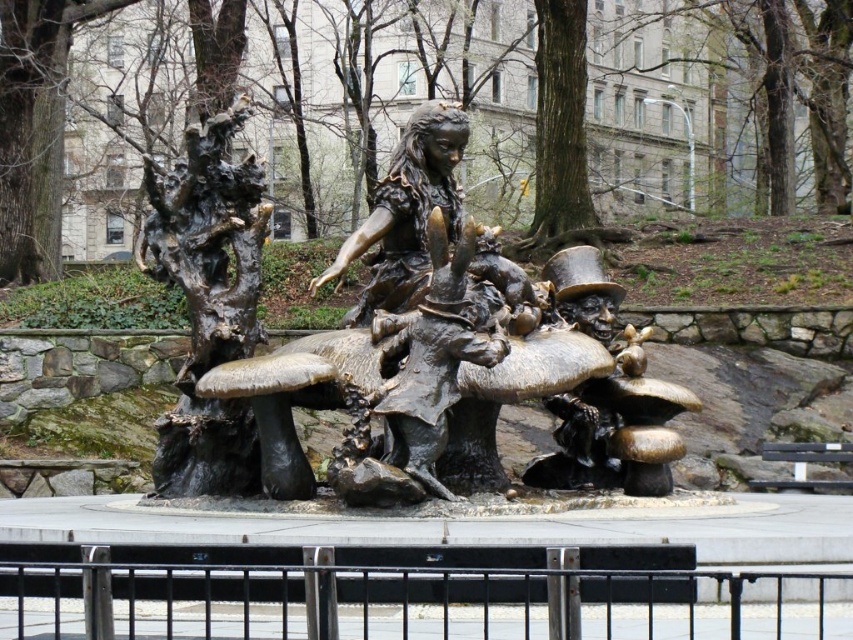
Based on the scene description, where is the bronze textured tree at center located in terms of coordinates?

The bronze textured tree at center is located at point coordinates of (550, 109).